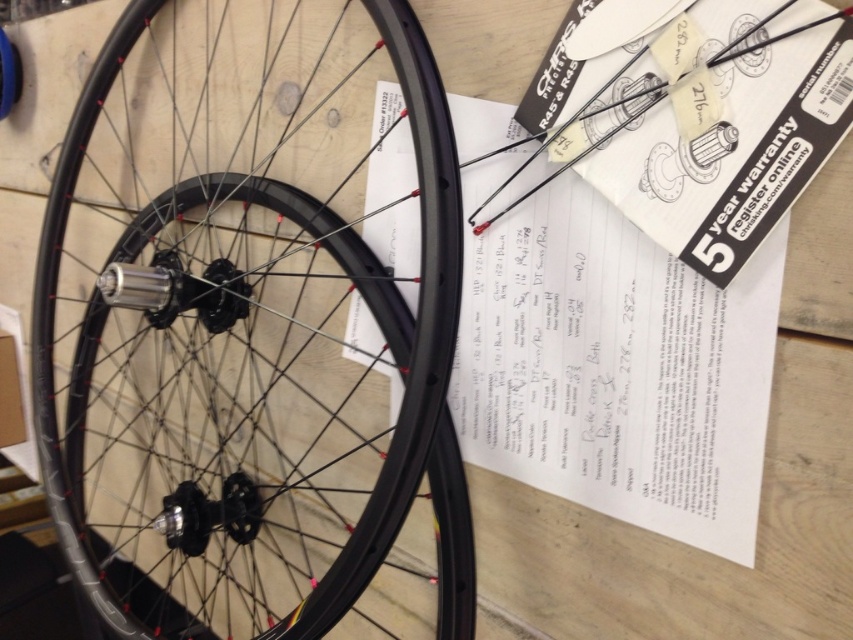
Question: Which of the following is the farthest from the observer?

Choices:
 (A) white paper at center
 (B) matte black rim at center

Answer: (B)

Question: Which point is closer to the camera?

Choices:
 (A) (296, 179)
 (B) (602, 429)

Answer: (B)

Question: Is matte black rim at center smaller than white paper at center?

Choices:
 (A) no
 (B) yes

Answer: (A)

Question: In this image, where is matte black rim at center located relative to white paper at center?

Choices:
 (A) right
 (B) left

Answer: (B)

Question: From the image, what is the correct spatial relationship of matte black rim at center in relation to white paper at center?

Choices:
 (A) left
 (B) right

Answer: (A)